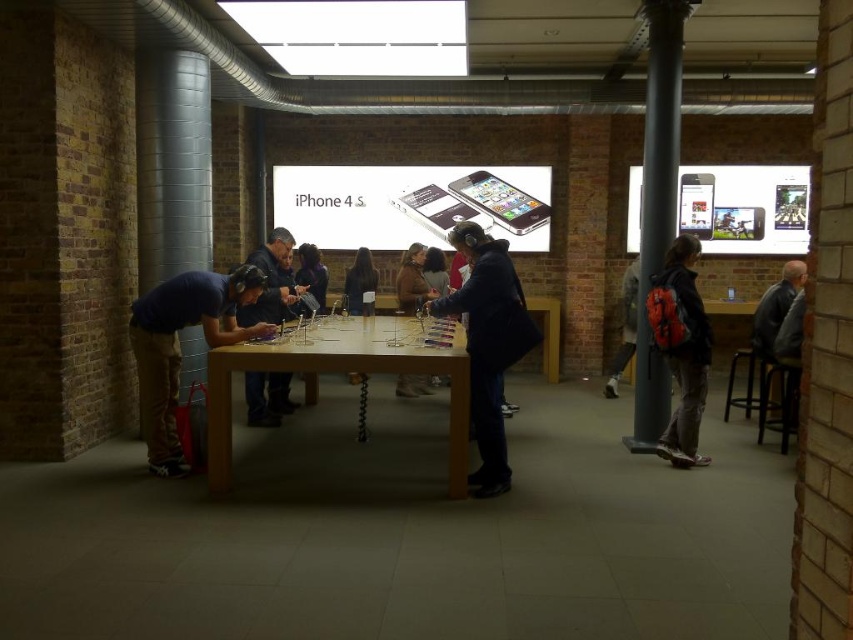
Between red backpack at center right and black plastic stool at lower right, which one has less height?

Standing shorter between the two is black plastic stool at lower right.

From the picture: Does red backpack at center right have a lesser height compared to black plastic stool at lower right?

Incorrect, red backpack at center right's height does not fall short of black plastic stool at lower right's.

Image resolution: width=853 pixels, height=640 pixels. What are the coordinates of `red backpack at center right` in the screenshot? It's located at (682, 348).

Does black plastic stool at lower right come behind dark brown hair at center?

No, it is not.

Describe the element at coordinates (778, 401) in the screenshot. Image resolution: width=853 pixels, height=640 pixels. I see `black plastic stool at lower right` at that location.

Where is `black plastic stool at lower right`? This screenshot has height=640, width=853. black plastic stool at lower right is located at coordinates point(778,401).

Find the location of a particular element. Image resolution: width=853 pixels, height=640 pixels. black plastic stool at lower right is located at coordinates tap(778, 401).

Is gray concrete pillar at right wider than blue fabric shirt at left?

No.

From the picture: Is gray concrete pillar at right shorter than blue fabric shirt at left?

No.

Does point (647, 420) come behind point (213, 324)?

Yes, point (647, 420) is farther from viewer.

Locate an element on the screen. gray concrete pillar at right is located at coordinates (657, 208).